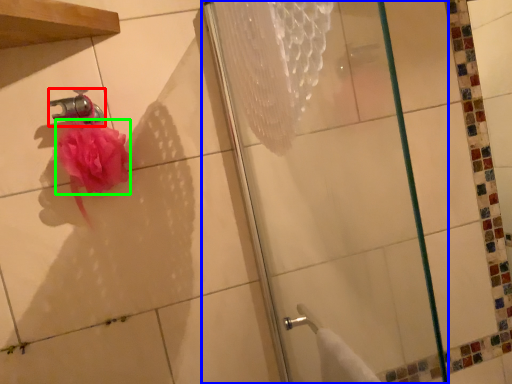
Question: Estimate the real-world distances between objects in this image. Which object is farther from faucet (highlighted by a red box), shower (highlighted by a blue box) or flower (highlighted by a green box)?

Choices:
 (A) shower
 (B) flower

Answer: (A)